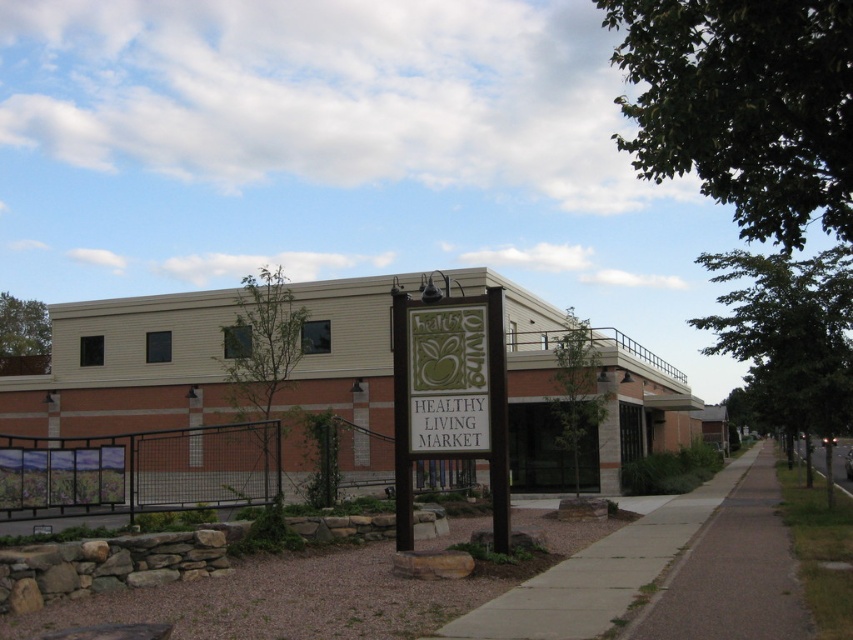
Is gray asphalt sidewalk at lower right behind green fabric sign at center?

No, gray asphalt sidewalk at lower right is in front of green fabric sign at center.

Can you confirm if gray asphalt sidewalk at lower right is bigger than green fabric sign at center?

Yes.

Which is behind, point (726, 552) or point (453, 420)?

The point (726, 552) is behind.

The width and height of the screenshot is (853, 640). Find the location of `gray asphalt sidewalk at lower right`. gray asphalt sidewalk at lower right is located at coordinates (730, 572).

Can you confirm if gray asphalt sidewalk at lower right is thinner than concrete sidewalk at center?

No, gray asphalt sidewalk at lower right is not thinner than concrete sidewalk at center.

What do you see at coordinates (730, 572) in the screenshot? The image size is (853, 640). I see `gray asphalt sidewalk at lower right` at bounding box center [730, 572].

Between point (688, 596) and point (490, 608), which one is positioned behind?

Positioned behind is point (688, 596).

Locate an element on the screen. This screenshot has height=640, width=853. gray asphalt sidewalk at lower right is located at coordinates (730, 572).

Where is `brown wooden sign at center`? The height and width of the screenshot is (640, 853). brown wooden sign at center is located at coordinates (450, 394).

Does brown wooden sign at center have a smaller size compared to green fabric sign at center?

Actually, brown wooden sign at center might be larger than green fabric sign at center.

Does point (422, 440) come behind point (454, 339)?

No, it is in front of (454, 339).

At what (x,y) coordinates should I click in order to perform the action: click on brown wooden sign at center. Please return your answer as a coordinate pair (x, y). Looking at the image, I should click on pyautogui.click(x=450, y=394).